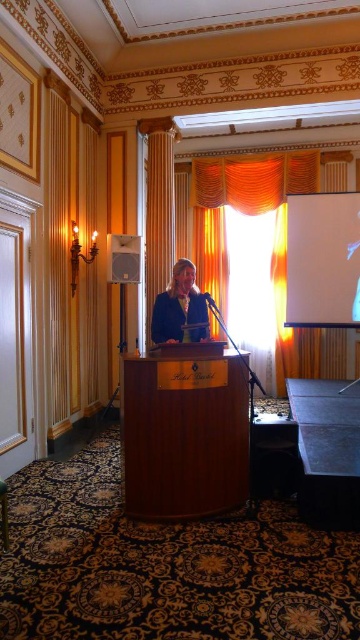
Question: Based on their relative distances, which object is farther from the white glossy projection screen at upper right?

Choices:
 (A) wooden podium at center
 (B) matte blue blazer at center

Answer: (A)

Question: Considering the relative positions of white glossy projection screen at upper right and matte blue blazer at center in the image provided, where is white glossy projection screen at upper right located with respect to matte blue blazer at center?

Choices:
 (A) above
 (B) below

Answer: (A)

Question: Is white glossy projection screen at upper right below matte blue blazer at center?

Choices:
 (A) yes
 (B) no

Answer: (B)

Question: Can you confirm if wooden podium at center is positioned below white glossy projection screen at upper right?

Choices:
 (A) no
 (B) yes

Answer: (B)

Question: Which is nearer to the wooden podium at center?

Choices:
 (A) matte blue blazer at center
 (B) matte white speaker at upper center
 (C) white glossy projection screen at upper right

Answer: (A)

Question: Which of the following is the closest to the observer?

Choices:
 (A) matte blue blazer at center
 (B) wooden podium at center
 (C) matte white speaker at upper center

Answer: (B)